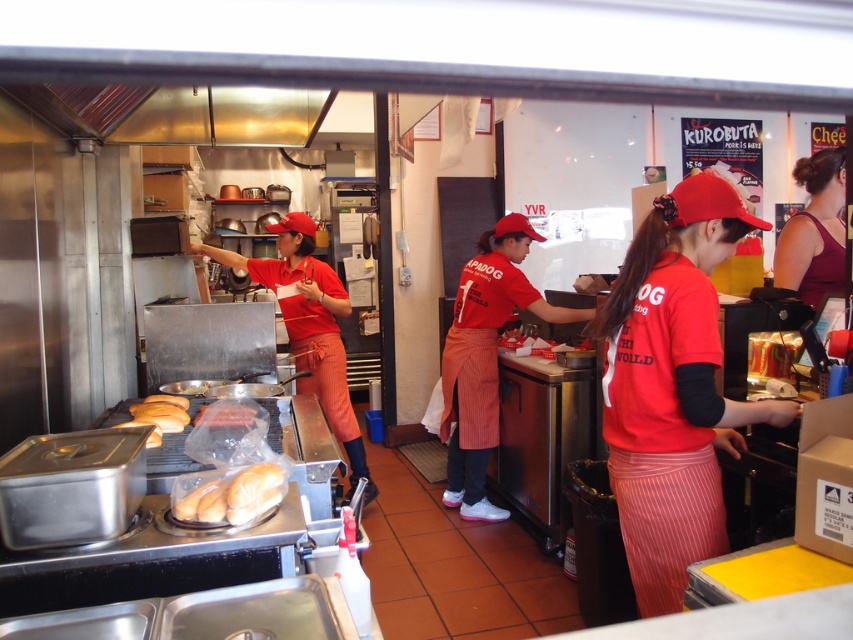
You are a customer trying to decide whether to grab the matte red cap at center or the golden bread at left to place on your hot dog. Which item is wider?

The matte red cap at center is wider than the golden bread at left, so you should choose the matte red cap at center if you want a wider item.

You are a customer trying to identify the staff members in the fast food restaurant. Which of the following items, the matte red cap at center or the matte red uniform at center, is smaller in size?

The matte red cap at center has a smaller size compared to the matte red uniform at center, so the matte red cap at center is smaller.